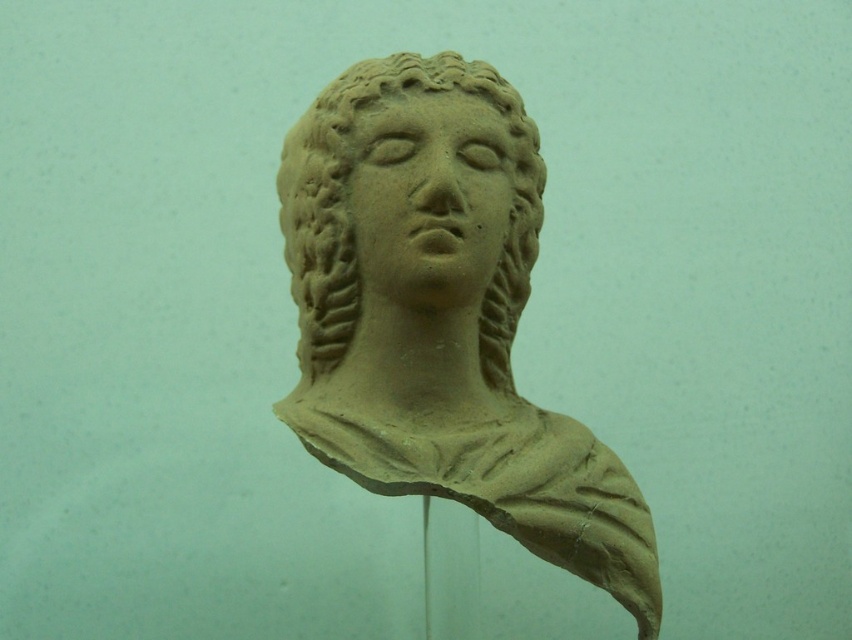
Question: Can you confirm if matte clay bust at center is smaller than matte clay face at center?

Choices:
 (A) no
 (B) yes

Answer: (A)

Question: Can you confirm if matte clay head at center is wider than matte clay face at center?

Choices:
 (A) yes
 (B) no

Answer: (A)

Question: Does matte clay head at center have a larger size compared to matte clay face at center?

Choices:
 (A) no
 (B) yes

Answer: (B)

Question: Which point is farther to the camera?

Choices:
 (A) matte clay bust at center
 (B) matte clay head at center
 (C) matte clay face at center

Answer: (B)

Question: Which point is closer to the camera taking this photo?

Choices:
 (A) (387, 173)
 (B) (419, 380)
 (C) (346, 285)

Answer: (B)

Question: Estimate the real-world distances between objects in this image. Which object is farther from the matte clay bust at center?

Choices:
 (A) matte clay head at center
 (B) matte clay face at center

Answer: (B)